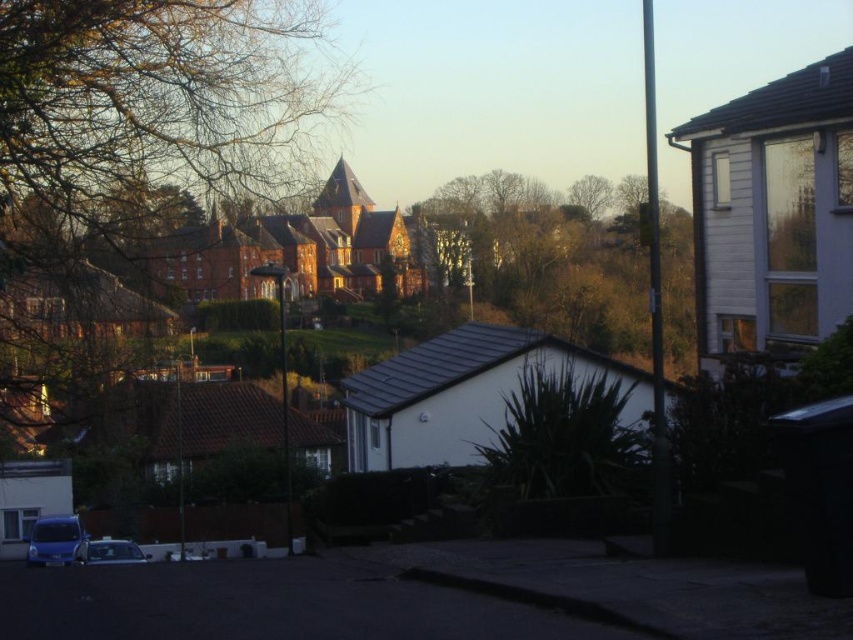
You are a drone operator who needs to fly a drone from the bare branches at upper left to the green leafy tree at center. What is the approximate distance you need to cover?

The distance between the bare branches at upper left and the green leafy tree at center is 41.29 meters, so the drone needs to cover approximately 41.29 meters.

You are a delivery person trying to park your metallic blue van at lower left. There is a tree with bare branches at upper left above your parking spot. Will the branches block the sunlight coming from the upper left direction?

The bare branches at upper left are positioned over the metallic blue van at lower left, so the branches will block some sunlight from the upper left direction onto the metallic blue van at lower left.